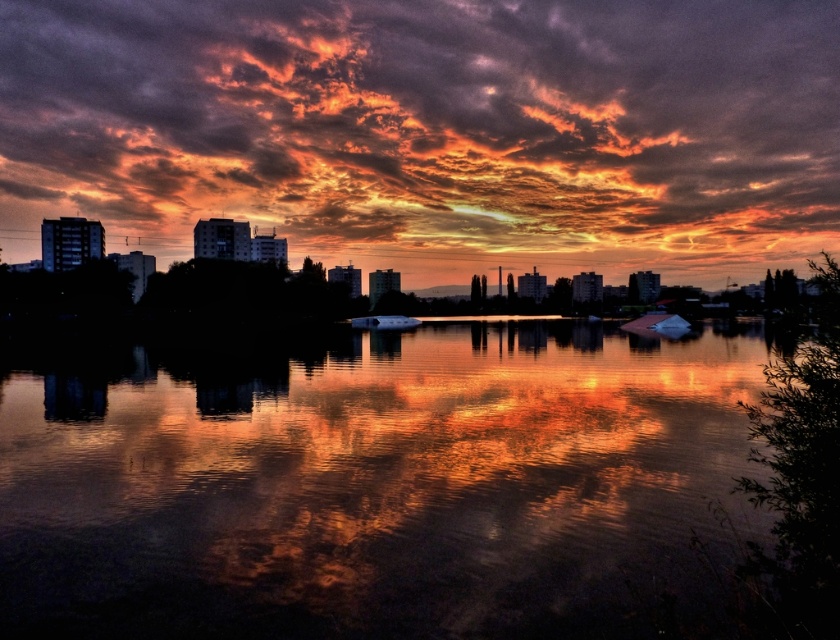
You are an architect designing a new building that needs to blend into the existing skyline. The building must not block the view of the orange textured clouds at upper center from the reflective glass water at center. Based on the scene, what should you consider about the building height?

The orange textured clouds at upper center are located above the reflective glass water at center, so the new building should be designed to have a height lower than the point where the clouds begin to ensure the view of the clouds remains unobstructed from the water.

You are an architect designing a new building that needs to align with the city skyline. Based on the scene, which object, the orange textured clouds at upper center or the reflective glass water at center, should you consider in terms of height for your design?

The orange textured clouds at upper center is much taller than the reflective glass water at center, so you should consider the height of the orange textured clouds at upper center to ensure the building aligns with the city skyline.